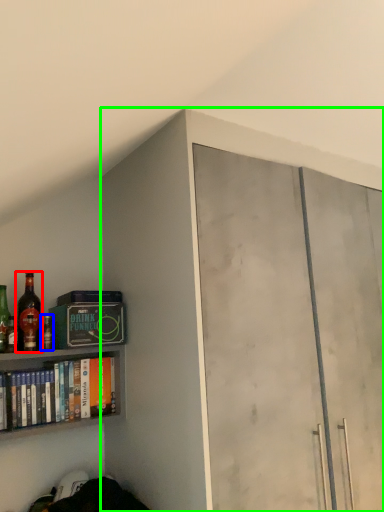
Question: Considering the real-world distances, which object is farthest from bottle (highlighted by a red box)? bottle (highlighted by a blue box) or cabinetry (highlighted by a green box)?

Choices:
 (A) bottle
 (B) cabinetry

Answer: (B)